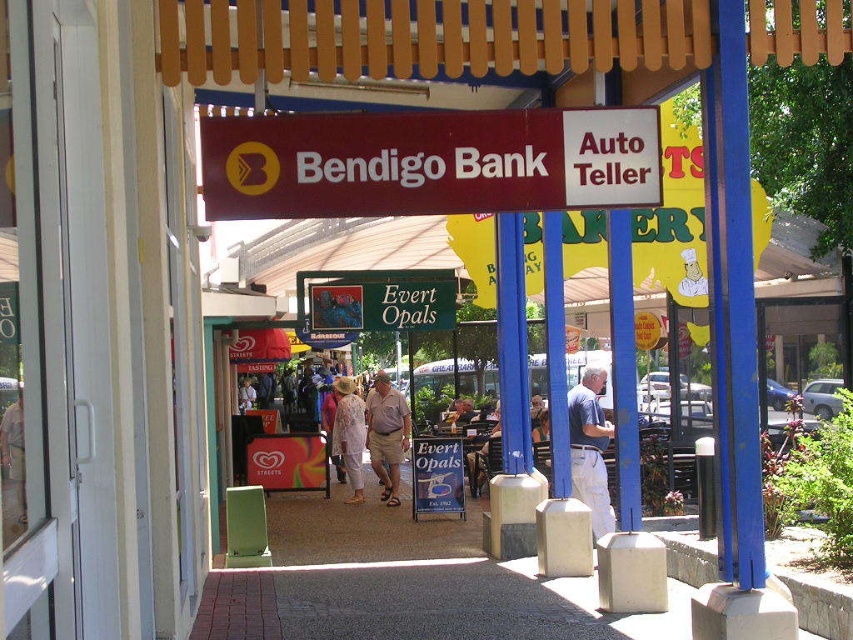
Between maroon plastic sign at center and light beige floral dress at center, which one appears on the right side from the viewer's perspective?

maroon plastic sign at center is more to the right.

Does point (393, 115) lie behind point (349, 417)?

No, it is not.

Is point (375, 138) less distant than point (363, 490)?

That is True.

Locate an element on the screen. maroon plastic sign at center is located at coordinates (428, 163).

Who is more distant from viewer, (595, 490) or (399, 436)?

The point (399, 436) is more distant.

Based on the photo, does light blue shirt at center appear on the right side of khaki cotton shorts at center?

Correct, you'll find light blue shirt at center to the right of khaki cotton shorts at center.

Between point (570, 412) and point (389, 476), which one is positioned behind?

The point (389, 476) is behind.

Locate an element on the screen. The width and height of the screenshot is (853, 640). light blue shirt at center is located at coordinates (590, 449).

Is maroon plastic sign at center bigger than khaki cotton shorts at center?

Actually, maroon plastic sign at center might be smaller than khaki cotton shorts at center.

Between point (614, 141) and point (376, 429), which one is positioned behind?

The point (376, 429) is more distant.

The height and width of the screenshot is (640, 853). What are the coordinates of `maroon plastic sign at center` in the screenshot? It's located at (428, 163).